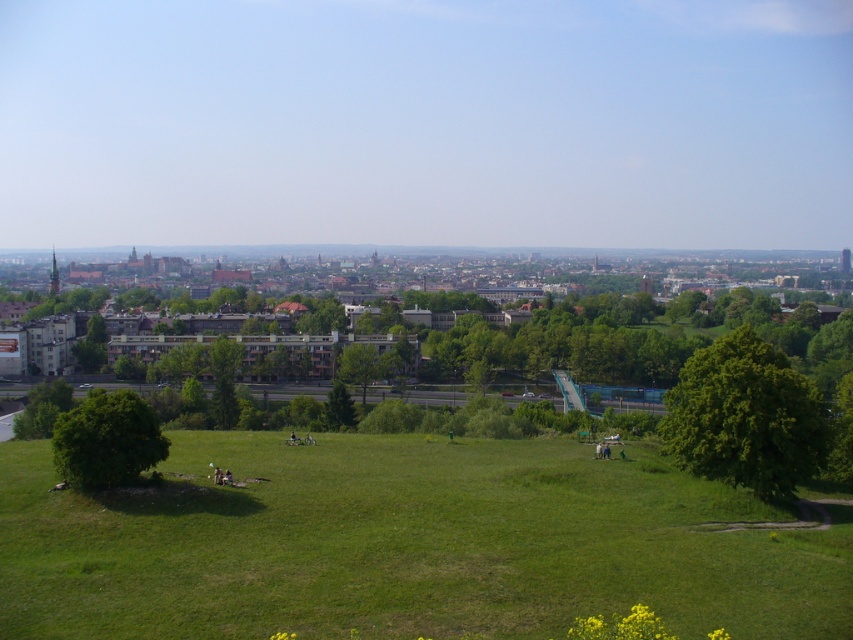
Between point (91, 444) and point (350, 374), which one is positioned behind?

The point (350, 374) is more distant.

Is green leafy tree at lower left bigger than green leafy tree at center?

No, green leafy tree at lower left is not bigger than green leafy tree at center.

Describe the element at coordinates (106, 440) in the screenshot. I see `green leafy tree at lower left` at that location.

Find the location of `green leafy tree at lower left`. green leafy tree at lower left is located at coordinates (106, 440).

Between green grassy field at center and green leafy tree at center-right, which one is positioned lower?

green grassy field at center

Based on the photo, is green grassy field at center bigger than green leafy tree at center-right?

Correct, green grassy field at center is larger in size than green leafy tree at center-right.

The width and height of the screenshot is (853, 640). Identify the location of green grassy field at center. (404, 545).

Which is behind, point (308, 620) or point (352, 364)?

Positioned behind is point (352, 364).

Identify the location of green grassy field at center. (404, 545).

Which is behind, point (483, 538) or point (344, 352)?

The point (344, 352) is more distant.

At what (x,y) coordinates should I click in order to perform the action: click on green grassy field at center. Please return your answer as a coordinate pair (x, y). Image resolution: width=853 pixels, height=640 pixels. Looking at the image, I should click on (404, 545).